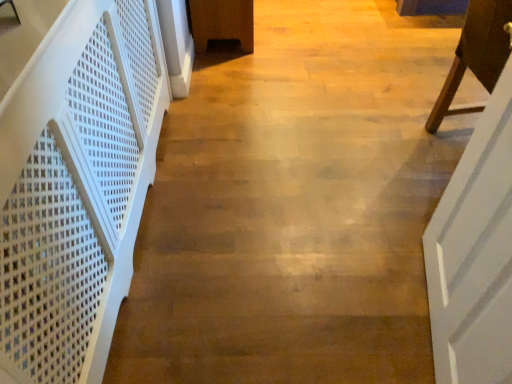
Question: Does white wooden door at right have a smaller size compared to white plastic stairwell at left?

Choices:
 (A) yes
 (B) no

Answer: (A)

Question: From the image's perspective, does white wooden door at right appear higher than white plastic stairwell at left?

Choices:
 (A) no
 (B) yes

Answer: (A)

Question: Is white wooden door at right at the left side of white plastic stairwell at left?

Choices:
 (A) no
 (B) yes

Answer: (A)

Question: Does white wooden door at right have a greater width compared to white plastic stairwell at left?

Choices:
 (A) no
 (B) yes

Answer: (A)

Question: Considering the relative sizes of white wooden door at right and white plastic stairwell at left in the image provided, is white wooden door at right bigger than white plastic stairwell at left?

Choices:
 (A) yes
 (B) no

Answer: (B)

Question: Is white wooden door at right closer to the viewer compared to white plastic stairwell at left?

Choices:
 (A) yes
 (B) no

Answer: (B)

Question: Are white plastic stairwell at left and white wooden door at right making contact?

Choices:
 (A) no
 (B) yes

Answer: (A)

Question: From a real-world perspective, does white plastic stairwell at left stand above white wooden door at right?

Choices:
 (A) no
 (B) yes

Answer: (A)

Question: From the image's perspective, is white plastic stairwell at left over white wooden door at right?

Choices:
 (A) no
 (B) yes

Answer: (B)

Question: Is white plastic stairwell at left oriented away from white wooden door at right?

Choices:
 (A) no
 (B) yes

Answer: (A)

Question: Does white plastic stairwell at left lie behind white wooden door at right?

Choices:
 (A) yes
 (B) no

Answer: (B)

Question: From the image's perspective, would you say white plastic stairwell at left is shown under white wooden door at right?

Choices:
 (A) no
 (B) yes

Answer: (A)

Question: From the image's perspective, is white wooden door at right located beneath brown wooden chair at right?

Choices:
 (A) yes
 (B) no

Answer: (A)